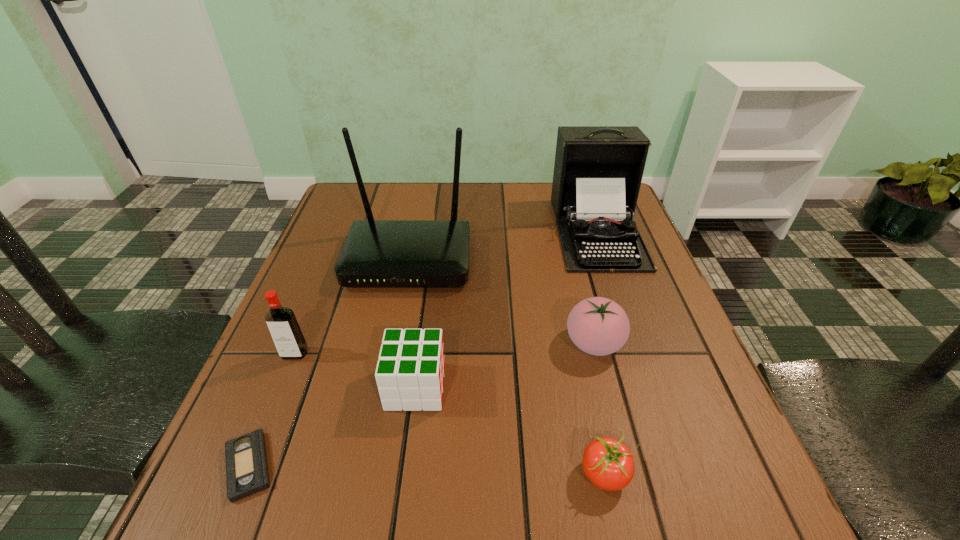
Where is `router`? router is located at coordinates (376, 253).

At what (x,y) coordinates should I click in order to perform the action: click on the sixth shortest object. Please return your answer as a coordinate pair (x, y). The image size is (960, 540). Looking at the image, I should click on (598, 170).

Locate an element on the screen. The height and width of the screenshot is (540, 960). the fifth shortest object is located at coordinates (285, 331).

You are a GUI agent. You are given a task and a screenshot of the screen. Output one action in this format:
    pyautogui.click(x=<x>, y=<y>)
    Task: Click on the farther tomato
    The height and width of the screenshot is (540, 960).
    Given the screenshot: What is the action you would take?
    pyautogui.click(x=598, y=326)

At what (x,y) coordinates should I click in order to perform the action: click on cube. Please return your answer as a coordinate pair (x, y). Looking at the image, I should click on (410, 371).

The height and width of the screenshot is (540, 960). In order to click on the nearer tomato in this screenshot , I will do `click(608, 463)`.

Where is `the second shortest object`? Image resolution: width=960 pixels, height=540 pixels. the second shortest object is located at coordinates (608, 463).

The width and height of the screenshot is (960, 540). I want to click on the shortest object, so click(x=247, y=473).

This screenshot has height=540, width=960. Identify the location of vacant region located on the front-facing side of the router. (372, 453).

Locate an element on the screen. vacant region located inside the open case of the typewriter is located at coordinates (631, 326).